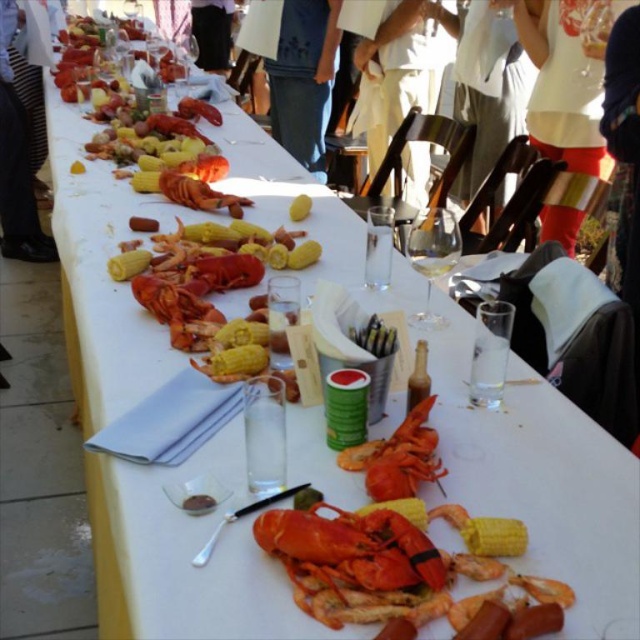
You are a guest at this outdoor gathering and want to reach for the orange lobster at center without touching the black fabric pants at upper center. Is this possible given their positions?

The orange lobster at center is located below the black fabric pants at upper center, so you can reach for the orange lobster at center without touching the black fabric pants at upper center as they are positioned above it.

You are a guest at this outdoor gathering and want to grab the shiny orange lobster at center without touching the black fabric pants at upper center. Is the lobster within reach?

The shiny orange lobster at center is in front of the black fabric pants at upper center, so it is within reach without touching the pants.